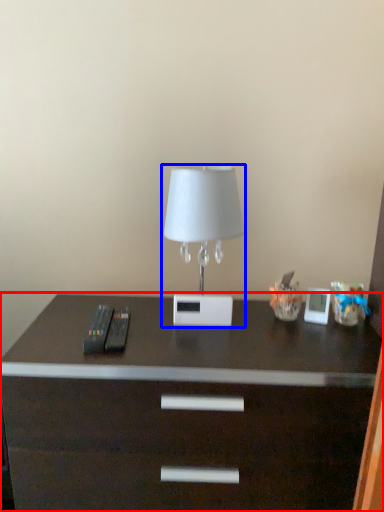
Question: Which object appears closest to the camera in this image, desk (highlighted by a red box) or lamp (highlighted by a blue box)?

Choices:
 (A) desk
 (B) lamp

Answer: (A)